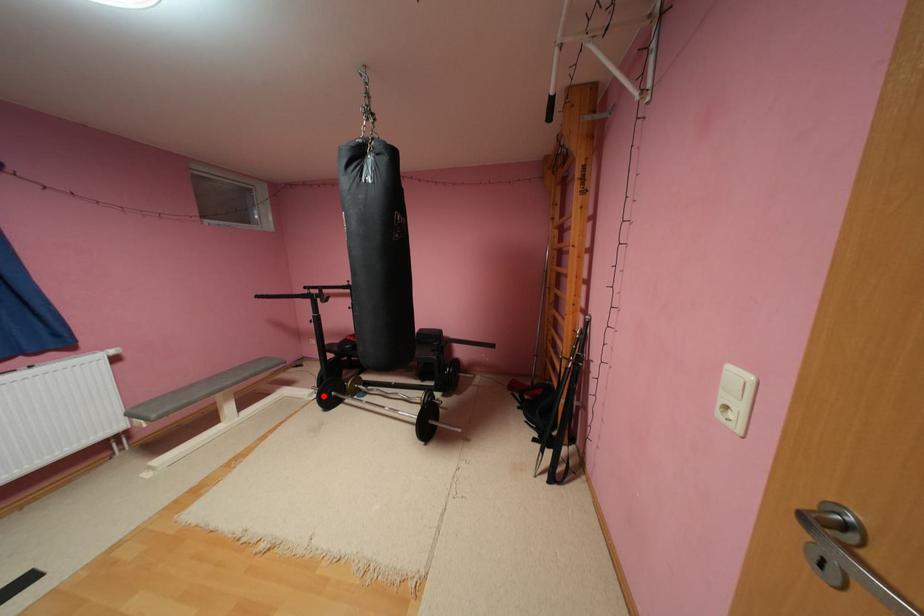
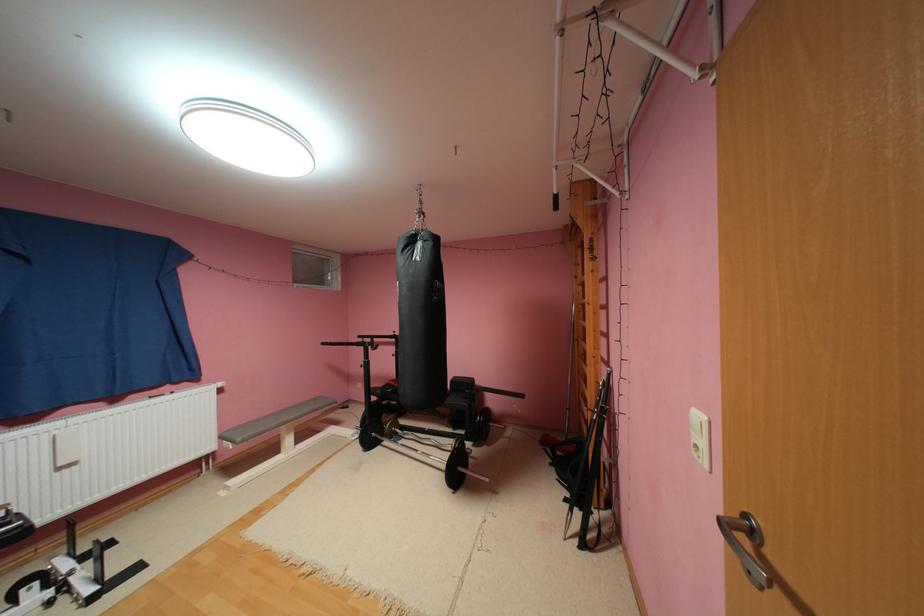
Locate, in the second image, the point that corresponds to the highlighted location in the first image.

(366, 436)